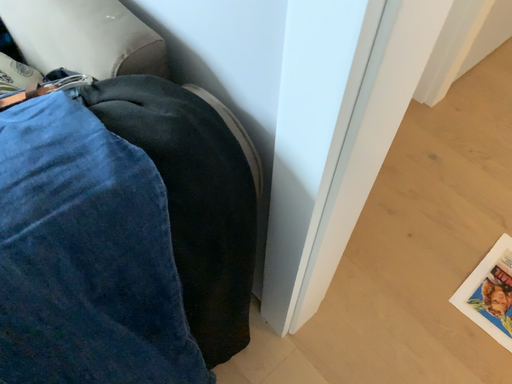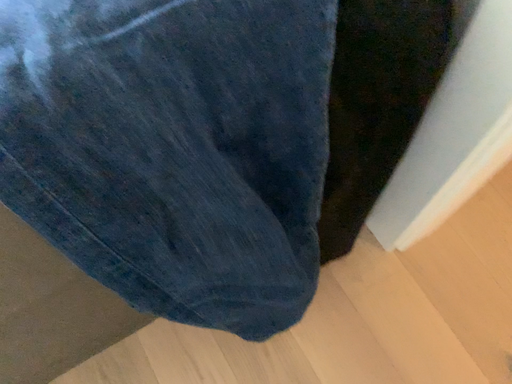
Question: How did the camera likely rotate when shooting the video?

Choices:
 (A) rotated left
 (B) rotated right

Answer: (A)